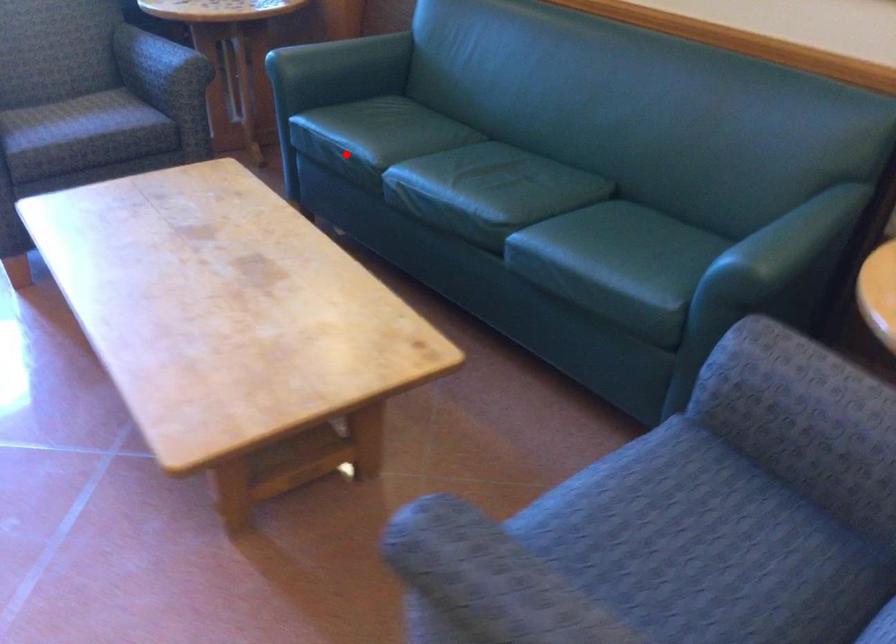
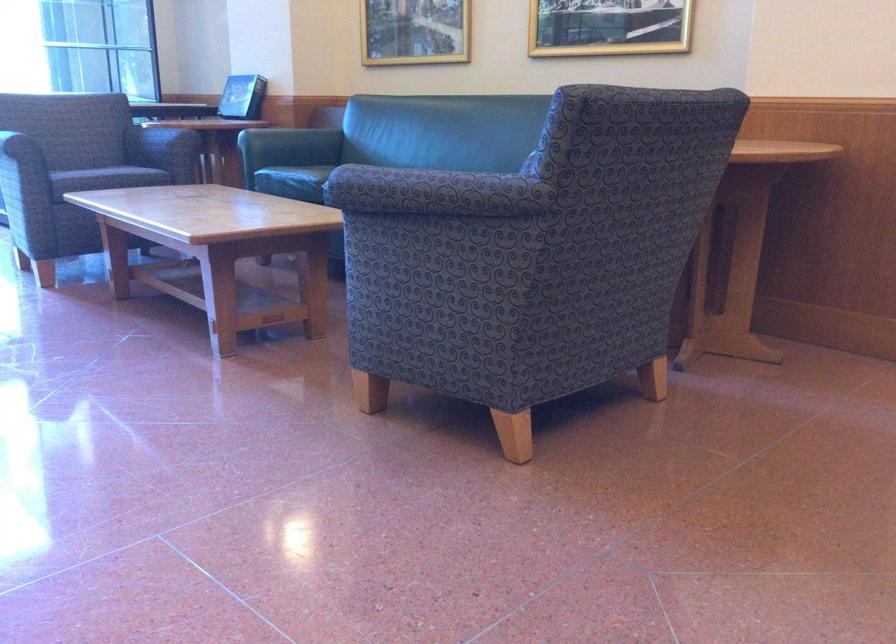
Find the pixel in the second image that matches the highlighted location in the first image.

(293, 182)